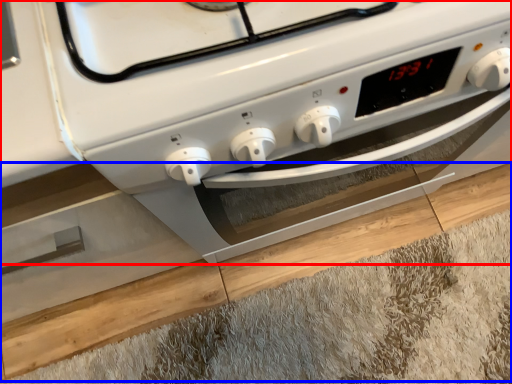
Question: Which object is closer to the camera taking this photo, home appliance (highlighted by a red box) or hardwood (highlighted by a blue box)?

Choices:
 (A) home appliance
 (B) hardwood

Answer: (A)